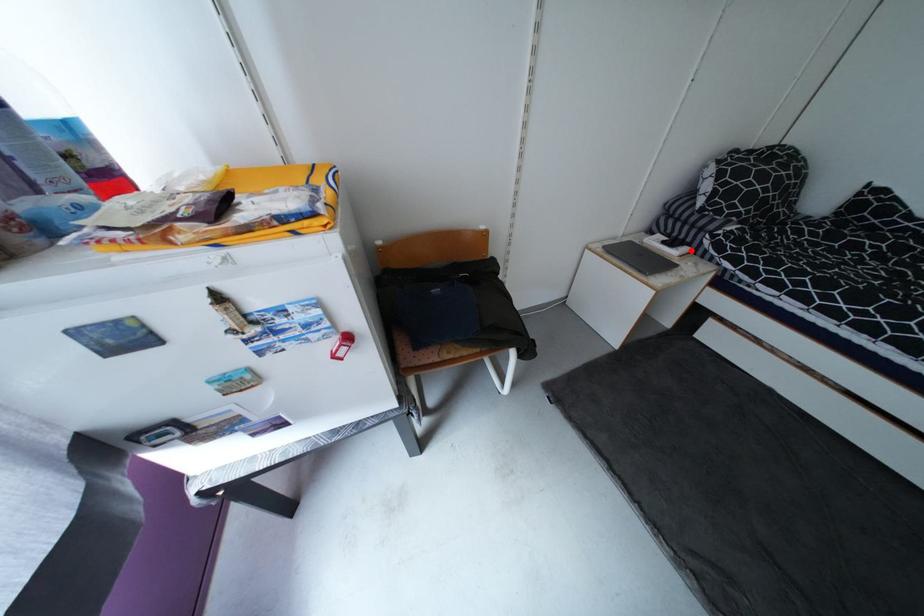
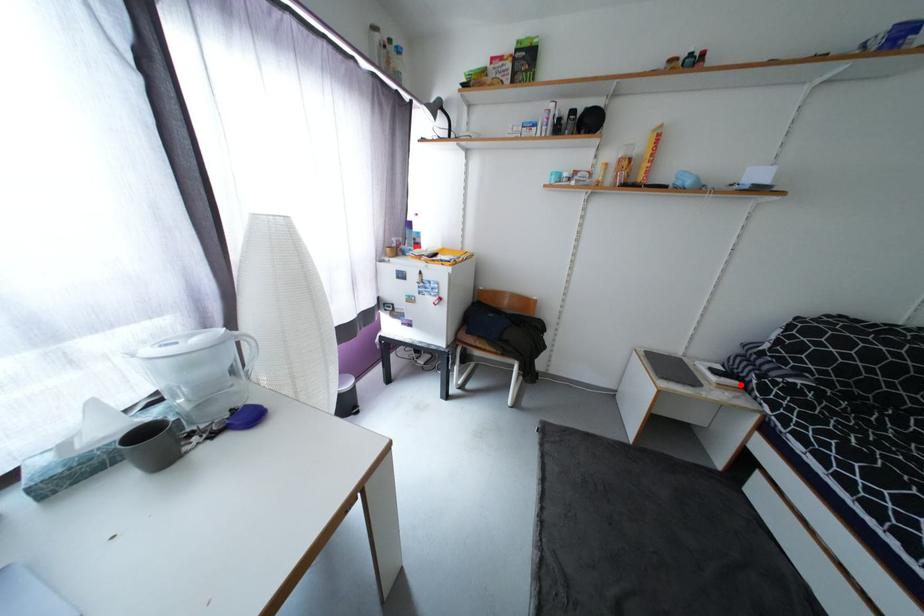
I am providing you with two images of the same scene from different viewpoints. A red point is marked on the first image and another point is marked on the second image. Do the highlighted points in image1 and image2 indicate the same real-world spot?

Yes